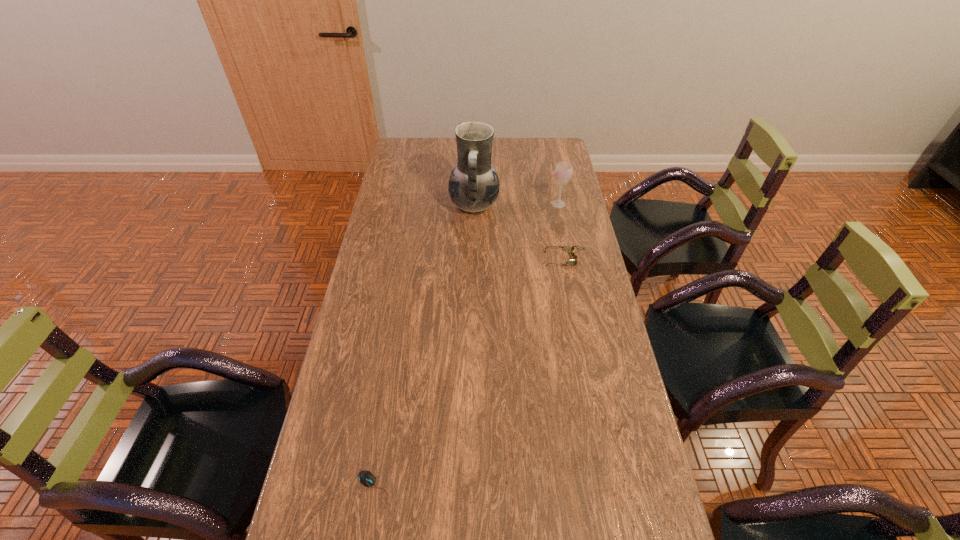
Identify the location of object that stands as the closest to the mouse. (567, 249).

Identify which object is the second nearest to the mouse. Please provide its 2D coordinates. Your answer should be formatted as a tuple, i.e. [(x, y)], where the tuple contains the x and y coordinates of a point satisfying the conditions above.

[(473, 186)]

Find the location of a particular element. This screenshot has width=960, height=540. vacant space that satisfies the following two spatial constraints: 1. on the front side of the wineglass; 2. on the front-facing side of the third tallest object is located at coordinates (570, 259).